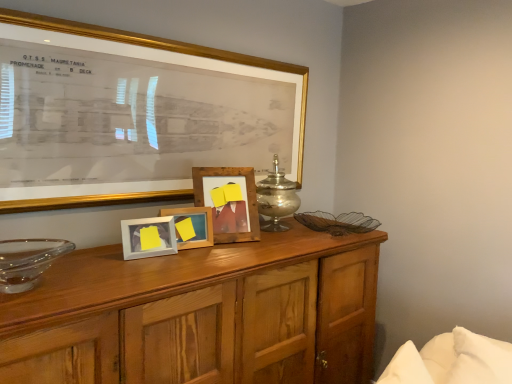
Identify the location of free spot to the right of transparent glass bowl at left. This screenshot has width=512, height=384. (91, 281).